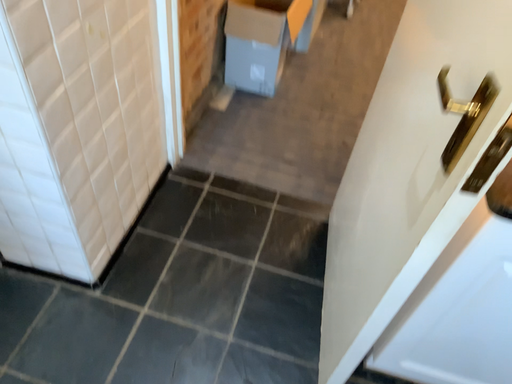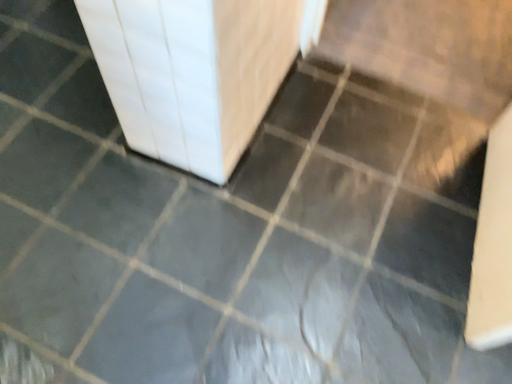
Question: How did the camera likely rotate when shooting the video?

Choices:
 (A) rotated upward
 (B) rotated downward

Answer: (B)